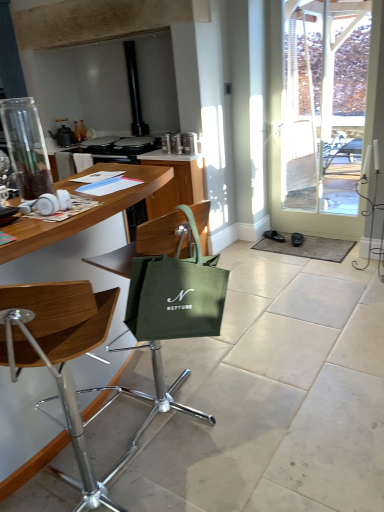
Question: In terms of size, does woodenmaterial/texturetable at left appear bigger or smaller than black leather shoe at lower right, the 2th footwear from the left?

Choices:
 (A) big
 (B) small

Answer: (A)

Question: Is woodenmaterial/texturetable at left in front of or behind black leather shoe at lower right, the 2th footwear from the left, in the image?

Choices:
 (A) front
 (B) behind

Answer: (A)

Question: Which object is the closest to the metallic black kettle at upper left?

Choices:
 (A) green canvas bag at center
 (B) black leather shoe at lower right, the 2th footwear from the left
 (C) black leather shoe at lower right, the 2th footwear positioned from the right
 (D) clear glass jar at left
 (E) green fabric bag at center, acting as the 1th chair starting from the back

Answer: (D)

Question: Which object is the closest to the wooden at left, which appears as the 2th chair when viewed from the back?

Choices:
 (A) woodenmaterial/texturetable at left
 (B) black leather shoe at lower right, the 2th footwear from the left
 (C) green fabric bag at center, which appears as the 2th chair when viewed from the front
 (D) metallic black kettle at upper left
 (E) clear glass jar at left

Answer: (A)